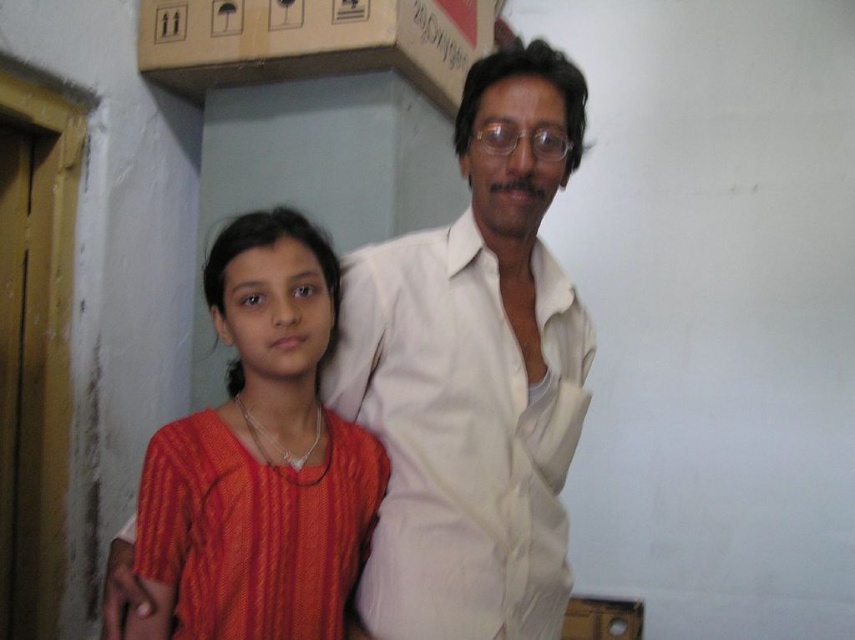
You are a photographer adjusting the lighting in the room. You need to ensure that both the white smooth shirt at center and the white cotton shirt at upper center are evenly lit. Given their current distance apart, do you think the lighting will be consistent between them?

The white smooth shirt at center and the white cotton shirt at upper center are only 0.83 inches apart from each other, so the lighting should be consistent between them.